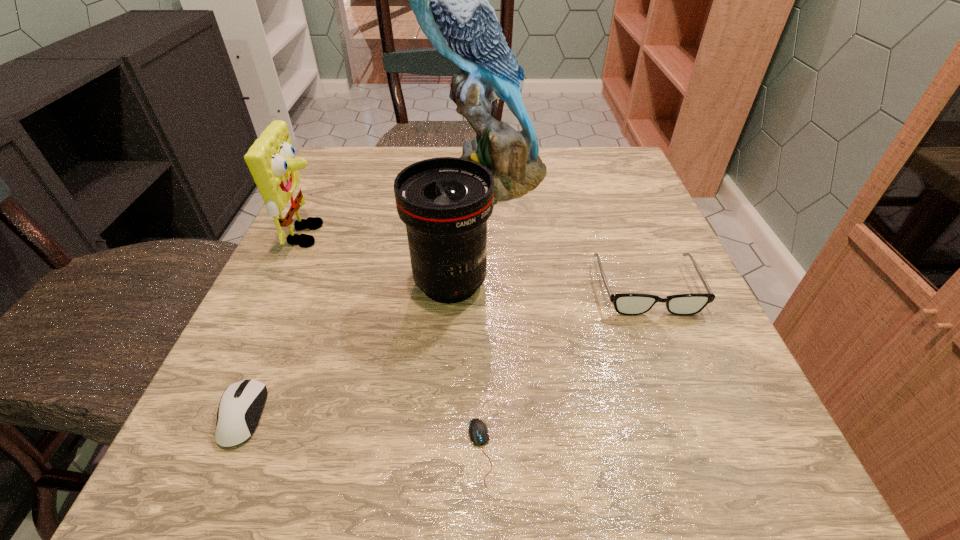
Find the location of a particular element. Image resolution: width=960 pixels, height=540 pixels. the tallest object is located at coordinates (449, 0).

Where is `parakeet`? The image size is (960, 540). parakeet is located at coordinates (449, 0).

Locate an element on the screen. This screenshot has height=540, width=960. sponge is located at coordinates (271, 160).

This screenshot has width=960, height=540. I want to click on telephoto lens, so click(x=445, y=202).

This screenshot has width=960, height=540. Identify the location of the third shortest object. (630, 304).

Where is `the rightmost object`? Image resolution: width=960 pixels, height=540 pixels. the rightmost object is located at coordinates (630, 304).

Where is `the taller mouse`? the taller mouse is located at coordinates (241, 404).

This screenshot has height=540, width=960. Identify the location of the left mouse. (241, 404).

Find the location of `the shorter mouse`. the shorter mouse is located at coordinates (478, 431).

Where is `the shortest object`? This screenshot has width=960, height=540. the shortest object is located at coordinates (478, 431).